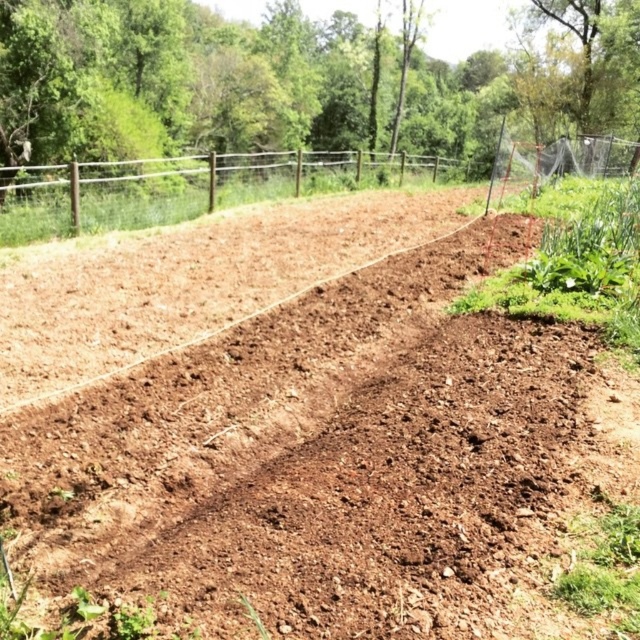
You are a gardener planning to plant a row of vegetables in the garden. You have a marker at point (337, 464) which is in the brown soil at center. If you want to plant a seed exactly 10 cm north of this point, where would you place it?

The point (337, 464) is located in the brown soil at center. To plant a seed 10 cm north of this point, you would move straight north from the brown soil at center by 10 cm.

You are a gardener standing at the edge of the garden. You see the brown soil at center and the brown wooden fence at upper center. Which object is closer to you?

The brown soil at center is closer to you because it is in front of the brown wooden fence at upper center.

You are standing in the garden and want to place a small marker between the two points, point (515,600) and point (257,170). Which point should the marker be closer to if you want it to be nearer to the viewer?

The marker should be placed closer to point (515,600) because it is closer to the viewer than point (257,170).